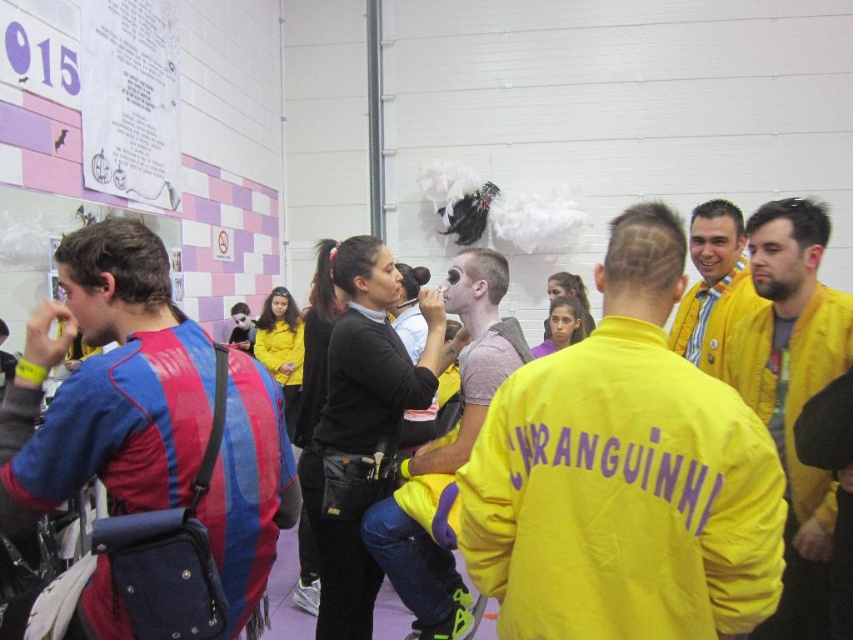
You are at an event and need to locate two jackets. The yellow fabric jacket at center and the yellow matte jacket at right. Which one is positioned higher?

The yellow fabric jacket at center is positioned higher than the yellow matte jacket at right.